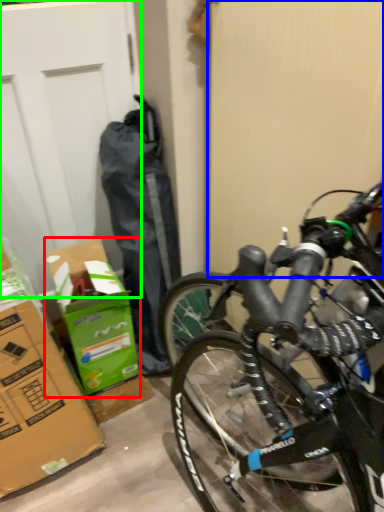
Question: Based on their relative distances, which object is farther from cardboard box (highlighted by a red box)? Choose from screen door (highlighted by a blue box) and garage door (highlighted by a green box).

Choices:
 (A) screen door
 (B) garage door

Answer: (A)